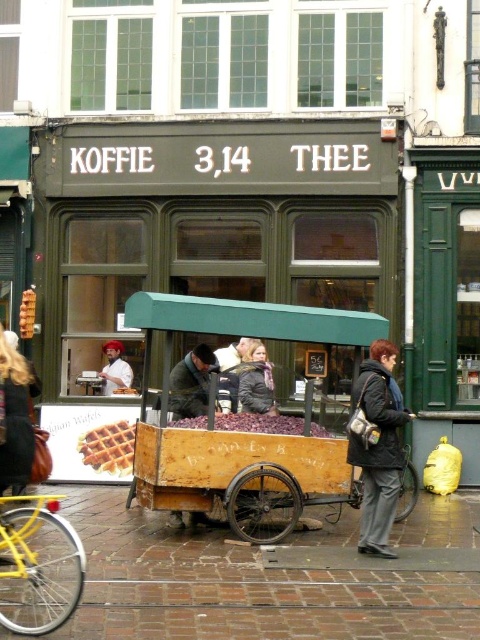
Between point (304, 326) and point (218, 413), which one is positioned in front?

Point (304, 326)

This screenshot has width=480, height=640. What do you see at coordinates (243, 422) in the screenshot?
I see `wooden cart at center` at bounding box center [243, 422].

Identify the location of wooden cart at center. This screenshot has height=640, width=480. (243, 422).

Which is in front, point (365, 529) or point (262, 396)?

Point (365, 529) is in front.

Does dark gray fabric jacket at lower right appear on the left side of dark gray jacket at center?

Incorrect, dark gray fabric jacket at lower right is not on the left side of dark gray jacket at center.

The height and width of the screenshot is (640, 480). In order to click on dark gray fabric jacket at lower right in this screenshot , I will do `click(377, 444)`.

The height and width of the screenshot is (640, 480). I want to click on dark gray fabric jacket at lower right, so click(377, 444).

Does yellow matte bicycle at lower left have a greater height compared to dark gray jacket at center?

Yes, yellow matte bicycle at lower left is taller than dark gray jacket at center.

Which is in front, point (58, 618) or point (271, 376)?

Point (58, 618)

Who is more distant from viewer, (x=16, y=531) or (x=243, y=362)?

The point (x=243, y=362) is behind.

The width and height of the screenshot is (480, 640). Find the location of `yellow matte bicycle at lower left`. yellow matte bicycle at lower left is located at coordinates (37, 564).